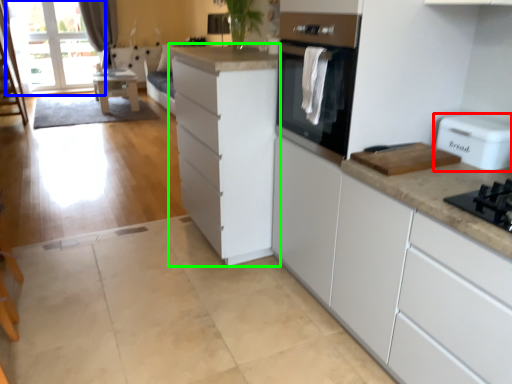
Question: Considering the real-world distances, which object is farthest from home appliance (highlighted by a red box)? window screen (highlighted by a blue box) or cabinetry (highlighted by a green box)?

Choices:
 (A) window screen
 (B) cabinetry

Answer: (A)